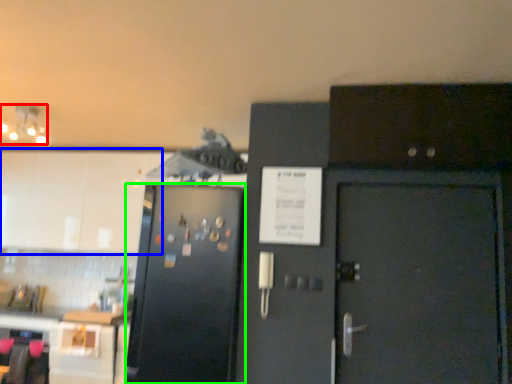
Question: Which is nearer to the lamp (highlighted by a red box)? cabinetry (highlighted by a blue box) or refrigerator (highlighted by a green box).

Choices:
 (A) cabinetry
 (B) refrigerator

Answer: (A)